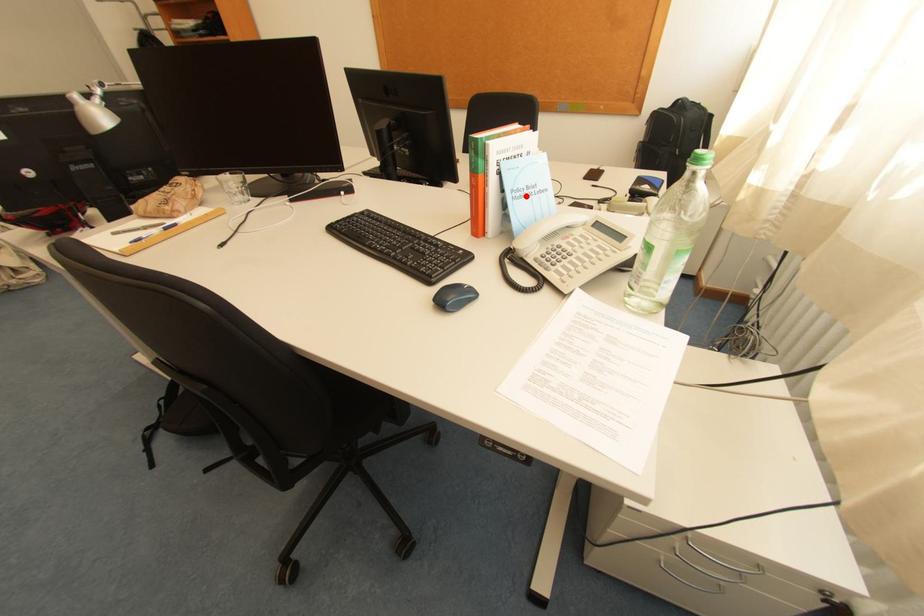
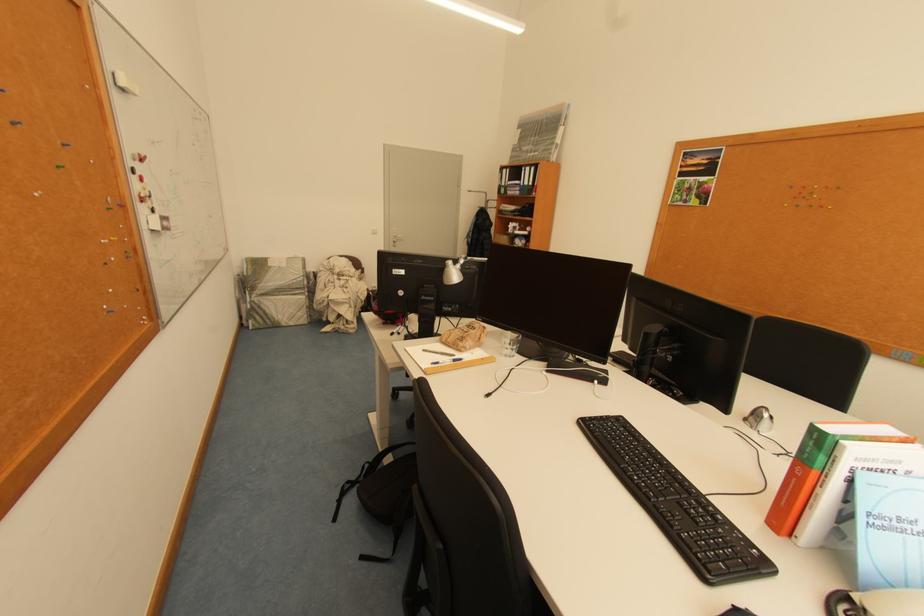
Where in the second image is the point corresponding to the highlighted location from the first image?

(886, 524)